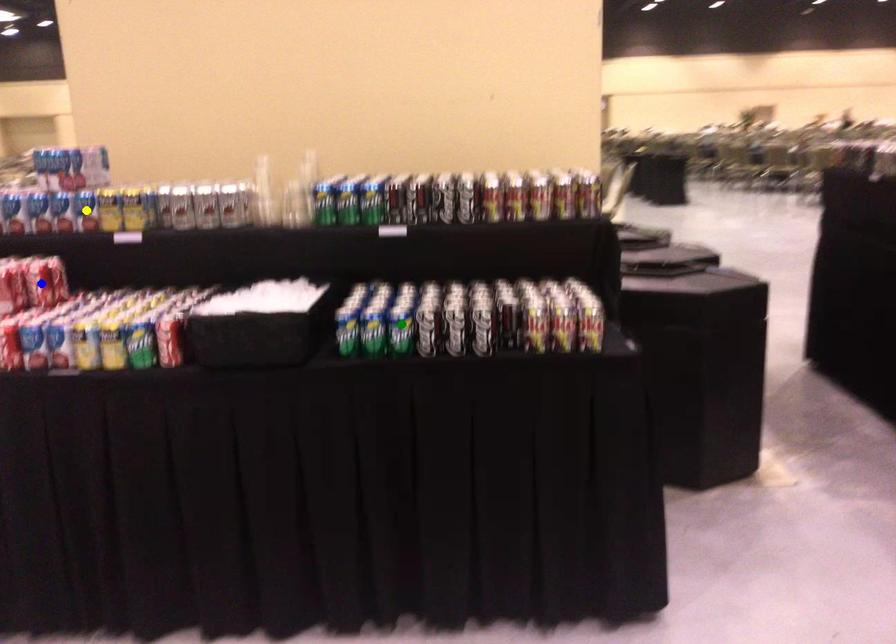
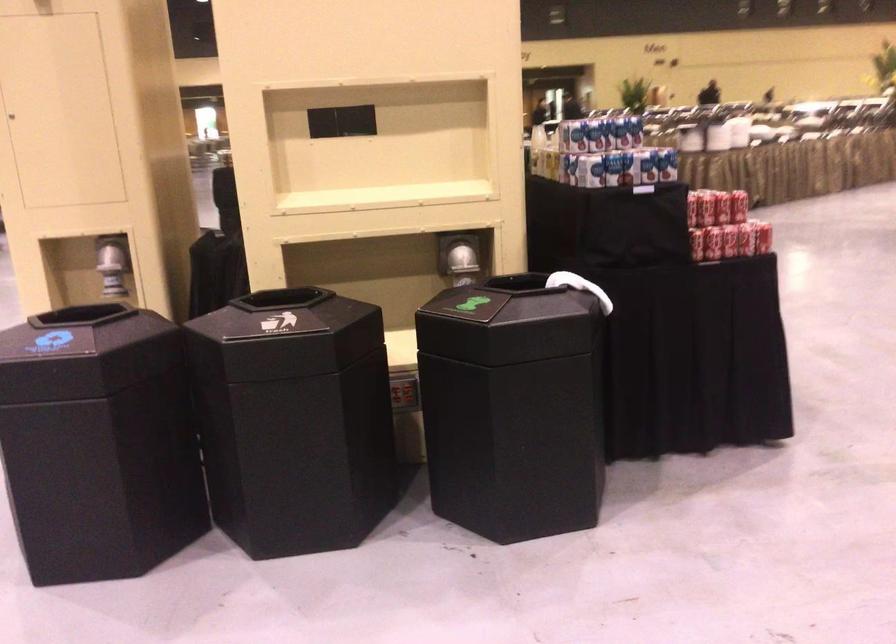
I am providing you with two images of the same scene from different viewpoints. Three points are marked in image1. Which point corresponds to a part or object that is occluded in image2?In image1, three points are marked. Which of them correspond to a part or object that is occluded in image2?Among the three points shown in image1, which one corresponds to a part or object that is no longer visible due to occlusion in image2?

Invisible in image2: blue point, yellow point, green point.